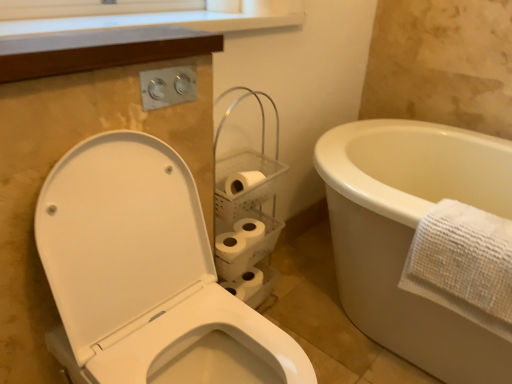
Question: From the image's perspective, is white glossy toilet at left beneath white textured towel at right?

Choices:
 (A) no
 (B) yes

Answer: (B)

Question: Can you confirm if white glossy toilet at left is wider than white textured towel at right?

Choices:
 (A) yes
 (B) no

Answer: (A)

Question: Is the depth of white glossy toilet at left greater than that of white textured towel at right?

Choices:
 (A) no
 (B) yes

Answer: (A)

Question: Is the surface of white glossy toilet at left in direct contact with white textured towel at right?

Choices:
 (A) no
 (B) yes

Answer: (A)

Question: Is white glossy toilet at left bigger than white textured towel at right?

Choices:
 (A) yes
 (B) no

Answer: (A)

Question: Is white glossy toilet at left not within white textured towel at right?

Choices:
 (A) yes
 (B) no

Answer: (A)

Question: Does white textured towel at right come behind white glossy toilet at left?

Choices:
 (A) yes
 (B) no

Answer: (A)

Question: Considering the relative sizes of white textured towel at right and white glossy toilet at left in the image provided, is white textured towel at right wider than white glossy toilet at left?

Choices:
 (A) no
 (B) yes

Answer: (A)

Question: Does white textured towel at right have a lesser height compared to white glossy toilet at left?

Choices:
 (A) no
 (B) yes

Answer: (B)

Question: Can you confirm if white textured towel at right is positioned to the left of white glossy toilet at left?

Choices:
 (A) no
 (B) yes

Answer: (A)

Question: Considering the relative sizes of white textured towel at right and white glossy toilet at left in the image provided, is white textured towel at right smaller than white glossy toilet at left?

Choices:
 (A) yes
 (B) no

Answer: (A)

Question: Does white textured towel at right appear on the right side of white glossy toilet at left?

Choices:
 (A) yes
 (B) no

Answer: (A)

Question: Is white textured towel at right shorter than white matte toilet paper at center?

Choices:
 (A) no
 (B) yes

Answer: (A)